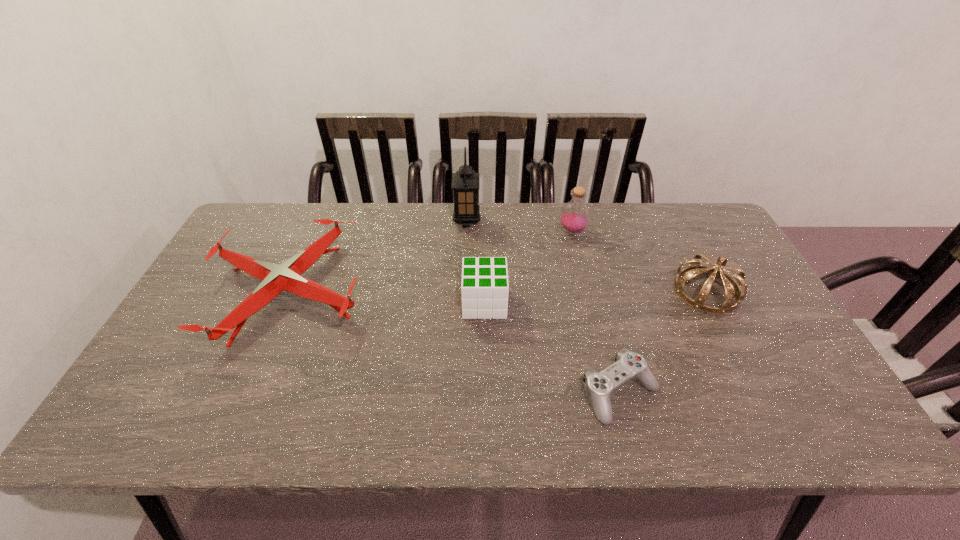
Where is `lantern`? The image size is (960, 540). lantern is located at coordinates (465, 182).

You are a GUI agent. You are given a task and a screenshot of the screen. Output one action in this format:
    pyautogui.click(x=<x>, y=<y>)
    Task: Click on the second tallest object
    Image resolution: width=960 pixels, height=540 pixels.
    Given the screenshot: What is the action you would take?
    pyautogui.click(x=574, y=217)

At what (x,y) coordinates should I click in order to perform the action: click on the rightmost object. Please return your answer as a coordinate pair (x, y). Looking at the image, I should click on (731, 285).

Identify the location of cube. (484, 288).

Locate an element on the screen. Image resolution: width=960 pixels, height=540 pixels. drone is located at coordinates (275, 278).

At what (x,y) coordinates should I click in order to perform the action: click on the fifth tallest object. Please return your answer as a coordinate pair (x, y). The height and width of the screenshot is (540, 960). Looking at the image, I should click on (275, 278).

Locate an element on the screen. This screenshot has height=540, width=960. control is located at coordinates (628, 365).

Locate an element on the screen. the shortest object is located at coordinates (628, 365).

Locate an element on the screen. This screenshot has width=960, height=540. vacant region located on the left of the lantern is located at coordinates (344, 221).

Find the location of a particular element. The image size is (960, 540). vacant area located on the right of the fifth shortest object is located at coordinates (605, 232).